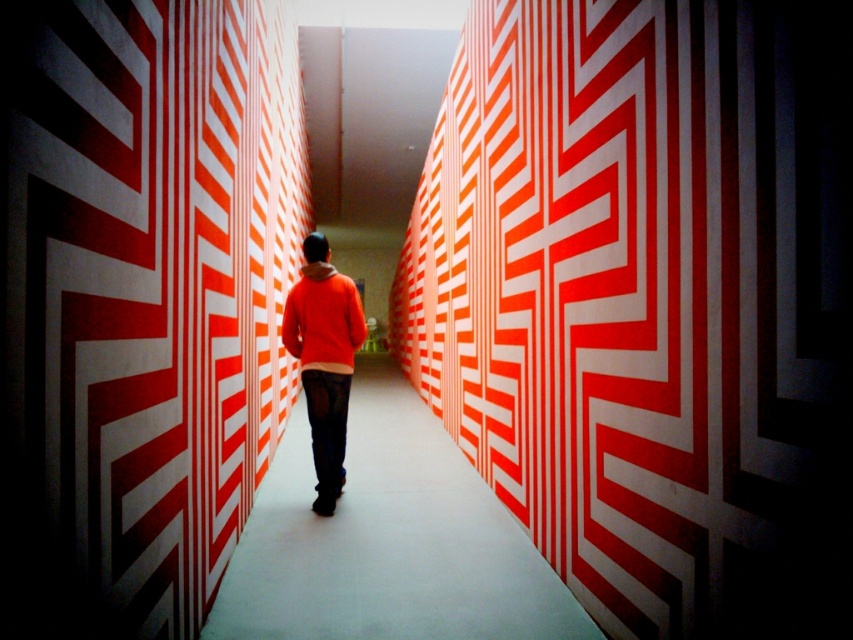
Question: Is orange matte sweater at center thinner than orange fleece sweatshirt at center?

Choices:
 (A) yes
 (B) no

Answer: (A)

Question: Which object is the farthest from the matte orange wall at center?

Choices:
 (A) orange fleece sweatshirt at center
 (B) orange matte sweater at center

Answer: (A)

Question: Observing the image, what is the correct spatial positioning of matte orange wall at center in reference to orange fleece sweatshirt at center?

Choices:
 (A) right
 (B) left

Answer: (A)

Question: Which point is closer to the camera?

Choices:
 (A) matte orange wall at center
 (B) orange matte sweater at center

Answer: (A)

Question: Is orange matte sweater at center to the right of orange fleece sweatshirt at center from the viewer's perspective?

Choices:
 (A) yes
 (B) no

Answer: (A)

Question: Which point is closer to the camera?

Choices:
 (A) orange fleece sweatshirt at center
 (B) orange matte sweater at center
 (C) matte orange wall at center

Answer: (C)